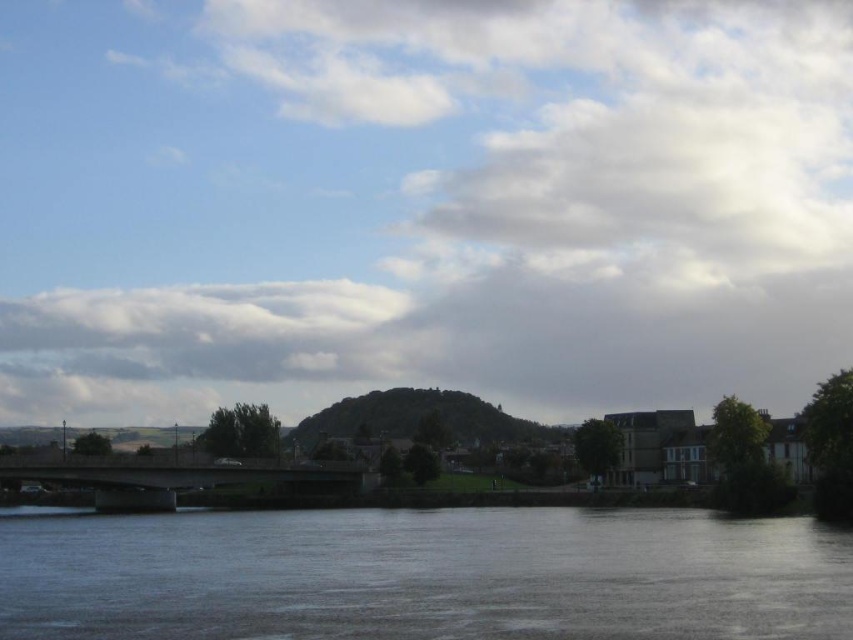
You are a photographer planning to capture a landscape shot of the cloudy sky at center and the smooth gray water at lower center. Which object will appear larger in the photo if you focus on the center of the image?

The cloudy sky at center will appear larger in the photo because it is much taller than the smooth gray water at lower center.

You are a photographer standing at the riverside and want to capture a photo of the cloudy sky at center and the smooth gray water at lower center. If your camera can focus on objects within 150 meters, will both objects be in focus?

The cloudy sky at center is 165.07 meters away from smooth gray water at lower center. Since the camera can only focus within 150 meters, the cloudy sky at center is beyond the camera range and will not be in focus, while the smooth gray water at lower center may be within range depending on its distance from the photographer. However, the description only provides the distance between the two objects, not their individual distances from the photographer. Therefore, it is uncertain if both will be in focus.

You are an artist trying to paint the riverside scene. You want to ensure the cloudy sky at center and the smooth gray water at lower center are positioned correctly. Based on the scene, which object should appear in front of the other?

The cloudy sky at center should appear in front of the smooth gray water at lower center because the smooth gray water at lower center is behind cloudy sky at center.